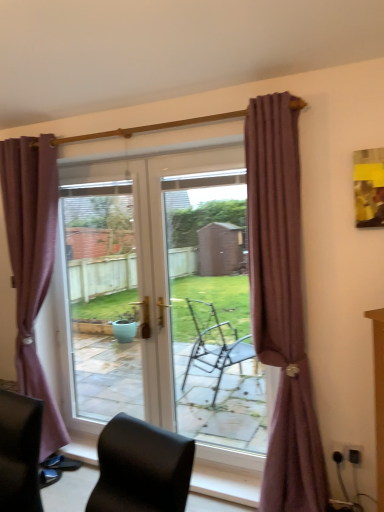
Question: Does transparent glass door at center lie in front of black leather chair at lower left?

Choices:
 (A) no
 (B) yes

Answer: (B)

Question: From the image's perspective, is transparent glass door at center located above black leather chair at lower left?

Choices:
 (A) yes
 (B) no

Answer: (A)

Question: Is transparent glass door at center to the left of black leather chair at lower left from the viewer's perspective?

Choices:
 (A) yes
 (B) no

Answer: (B)

Question: Considering the relative sizes of transparent glass door at center and black leather chair at lower left in the image provided, is transparent glass door at center wider than black leather chair at lower left?

Choices:
 (A) no
 (B) yes

Answer: (A)

Question: Is transparent glass door at center not inside black leather chair at lower left?

Choices:
 (A) no
 (B) yes

Answer: (B)

Question: From the image's perspective, is mauve fabric curtain at right, which is counted as the 2th curtain, starting from the left, positioned above or below transparent glass door at center?

Choices:
 (A) above
 (B) below

Answer: (A)

Question: Is mauve fabric curtain at right, the 1th curtain viewed from the right, spatially inside transparent glass door at center, or outside of it?

Choices:
 (A) outside
 (B) inside

Answer: (A)

Question: Is point (271, 272) positioned closer to the camera than point (246, 304)?

Choices:
 (A) farther
 (B) closer

Answer: (B)

Question: Would you say mauve fabric curtain at right, which is the second curtain from back to front, is to the left or to the right of transparent glass door at center in the picture?

Choices:
 (A) left
 (B) right

Answer: (B)

Question: From a real-world perspective, is purple fabric curtain at left, which ranks as the 2th curtain in front-to-back order, above or below transparent glass door at center?

Choices:
 (A) below
 (B) above

Answer: (B)

Question: Considering their positions, is purple fabric curtain at left, which is counted as the first curtain, starting from the left, located in front of or behind transparent glass door at center?

Choices:
 (A) behind
 (B) front

Answer: (B)

Question: From the image's perspective, is purple fabric curtain at left, the 2th curtain when ordered from right to left, positioned above or below transparent glass door at center?

Choices:
 (A) below
 (B) above

Answer: (B)

Question: In terms of height, does purple fabric curtain at left, the 1th curtain viewed from the back, look taller or shorter compared to transparent glass door at center?

Choices:
 (A) short
 (B) tall

Answer: (B)

Question: Visually, is black leather chair at lower left positioned to the left or to the right of transparent glass door at center?

Choices:
 (A) left
 (B) right

Answer: (A)

Question: From a real-world perspective, is black leather chair at lower left positioned above or below transparent glass door at center?

Choices:
 (A) above
 (B) below

Answer: (B)